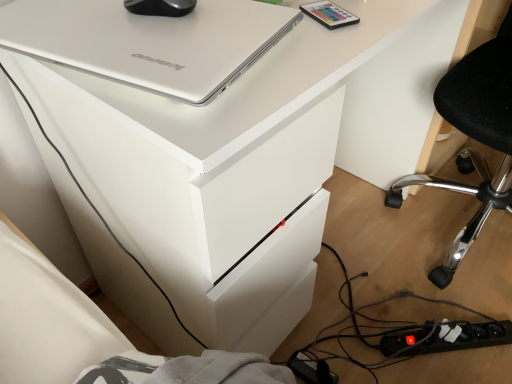
Describe the element at coordinates (160, 7) in the screenshot. I see `black rubberized mouse at upper center` at that location.

What do you see at coordinates (474, 137) in the screenshot? This screenshot has width=512, height=384. I see `black plastic chair at lower right` at bounding box center [474, 137].

Find the location of a particular element. This screenshot has height=384, width=512. matte plastic remote control at upper right is located at coordinates (329, 14).

Identify the location of black rubberized mouse at upper center. This screenshot has height=384, width=512. (160, 7).

Is silver metallic laptop at upper left touching black rubberized mouse at upper center?

No.

Measure the distance between silver metallic laptop at upper left and black rubberized mouse at upper center.

4.12 inches.

Who is bigger, silver metallic laptop at upper left or black rubberized mouse at upper center?

silver metallic laptop at upper left is bigger.

Is silver metallic laptop at upper left in front of or behind black rubberized mouse at upper center in the image?

silver metallic laptop at upper left is positioned closer to the viewer than black rubberized mouse at upper center.

The width and height of the screenshot is (512, 384). I want to click on mouse lying behind the silver metallic laptop at upper left, so click(x=160, y=7).

Is black rubberized mouse at upper center far away from silver metallic laptop at upper left?

No, black rubberized mouse at upper center is not far from silver metallic laptop at upper left.

Between black rubberized mouse at upper center and silver metallic laptop at upper left, which one appears on the left side from the viewer's perspective?

Positioned to the left is silver metallic laptop at upper left.

From the image's perspective, relative to silver metallic laptop at upper left, is black rubberized mouse at upper center above or below?

black rubberized mouse at upper center is situated higher than silver metallic laptop at upper left in the image.

Is point (132, 7) farther from viewer compared to point (497, 67)?

That is False.

From the image's perspective, is black rubberized mouse at upper center below black plastic chair at lower right?

Incorrect, from the image's perspective, black rubberized mouse at upper center is higher than black plastic chair at lower right.

Would you say black rubberized mouse at upper center contains black plastic chair at lower right?

That's incorrect, black plastic chair at lower right is not inside black rubberized mouse at upper center.

Which of these two, black rubberized mouse at upper center or black plastic chair at lower right, is wider?

With larger width is black plastic chair at lower right.

Is silver metallic laptop at upper left surrounded by black plastic chair at lower right?

No, silver metallic laptop at upper left is not a part of black plastic chair at lower right.

Can you see black plastic chair at lower right touching silver metallic laptop at upper left?

No, black plastic chair at lower right is not beside silver metallic laptop at upper left.

Can you tell me how much black plastic chair at lower right and silver metallic laptop at upper left differ in facing direction?

They differ by 102 degrees in their facing directions.

Is silver metallic laptop at upper left at the back of black plastic power strip at lower right?

That's not correct — black plastic power strip at lower right is not looking away from silver metallic laptop at upper left.

Looking at this image, which of these two, black plastic power strip at lower right or silver metallic laptop at upper left, stands taller?

With more height is black plastic power strip at lower right.

From a real-world perspective, is black plastic power strip at lower right physically below silver metallic laptop at upper left?

Yes.

Is point (441, 350) closer to camera compared to point (212, 61)?

No, (441, 350) is behind (212, 61).

Choose the correct answer: Is matte plastic remote control at upper right inside silver metallic laptop at upper left or outside it?

matte plastic remote control at upper right is located beyond the bounds of silver metallic laptop at upper left.

From the image's perspective, which is above, matte plastic remote control at upper right or silver metallic laptop at upper left?

matte plastic remote control at upper right.

Does matte plastic remote control at upper right have a lesser height compared to silver metallic laptop at upper left?

Correct, matte plastic remote control at upper right is not as tall as silver metallic laptop at upper left.

Considering the relative positions of matte plastic remote control at upper right and black plastic chair at lower right in the image provided, is matte plastic remote control at upper right to the left of black plastic chair at lower right from the viewer's perspective?

Correct, you'll find matte plastic remote control at upper right to the left of black plastic chair at lower right.

Is black plastic chair at lower right located within matte plastic remote control at upper right?

No, black plastic chair at lower right is not inside matte plastic remote control at upper right.

Between matte plastic remote control at upper right and black plastic chair at lower right, which one has larger size?

black plastic chair at lower right.

Is matte plastic remote control at upper right taller than black plastic chair at lower right?

No, matte plastic remote control at upper right is not taller than black plastic chair at lower right.

Image resolution: width=512 pixels, height=384 pixels. Find the location of `laptop below the black rubberized mouse at upper center (from a real-world perspective)`. laptop below the black rubberized mouse at upper center (from a real-world perspective) is located at coordinates (149, 41).

Where is `laptop that appears below the black rubberized mouse at upper center (from the image's perspective)`? The image size is (512, 384). laptop that appears below the black rubberized mouse at upper center (from the image's perspective) is located at coordinates (149, 41).

Considering their positions, is black rubberized mouse at upper center positioned further to black plastic chair at lower right than silver metallic laptop at upper left?

Among the two, black rubberized mouse at upper center is located further to black plastic chair at lower right.

From the image, which object appears to be nearer to black rubberized mouse at upper center, matte plastic remote control at upper right or black plastic power strip at lower right?

matte plastic remote control at upper right lies closer to black rubberized mouse at upper center than the other object.

Which object lies further to the anchor point matte plastic remote control at upper right, black plastic power strip at lower right or silver metallic laptop at upper left?

black plastic power strip at lower right is positioned further to the anchor matte plastic remote control at upper right.

Based on their spatial positions, is matte plastic remote control at upper right or black plastic power strip at lower right closer to silver metallic laptop at upper left?

matte plastic remote control at upper right is closer to silver metallic laptop at upper left.

Consider the image. Estimate the real-world distances between objects in this image. Which object is further from black rubberized mouse at upper center, silver metallic laptop at upper left or matte plastic remote control at upper right?

The object further to black rubberized mouse at upper center is matte plastic remote control at upper right.

Looking at the image, which one is located further to black rubberized mouse at upper center, black plastic chair at lower right or matte plastic remote control at upper right?

black plastic chair at lower right is further to black rubberized mouse at upper center.

Looking at this image, when comparing their distances from black plastic power strip at lower right, does silver metallic laptop at upper left or matte plastic remote control at upper right seem closer?

matte plastic remote control at upper right is positioned closer to the anchor black plastic power strip at lower right.

When comparing their distances from silver metallic laptop at upper left, does black plastic power strip at lower right or matte plastic remote control at upper right seem closer?

The object closer to silver metallic laptop at upper left is matte plastic remote control at upper right.

This screenshot has height=384, width=512. Identify the location of mouse between silver metallic laptop at upper left and matte plastic remote control at upper right from left to right. (160, 7).

The image size is (512, 384). In order to click on furniture between matte plastic remote control at upper right and black plastic power strip at lower right vertically in this screenshot , I will do `click(474, 137)`.

Identify the location of mouse that lies between matte plastic remote control at upper right and black plastic power strip at lower right from top to bottom. The image size is (512, 384). (160, 7).

Identify the location of equipment located between silver metallic laptop at upper left and black plastic chair at lower right in the left-right direction. (329, 14).